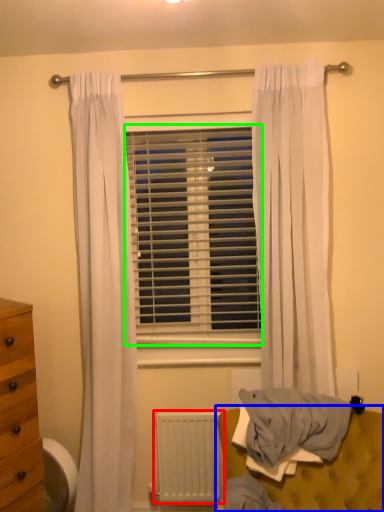
Question: Estimate the real-world distances between objects in this image. Which object is farther from radiator (highlighted by a red box), furniture (highlighted by a blue box) or window blind (highlighted by a green box)?

Choices:
 (A) furniture
 (B) window blind

Answer: (B)